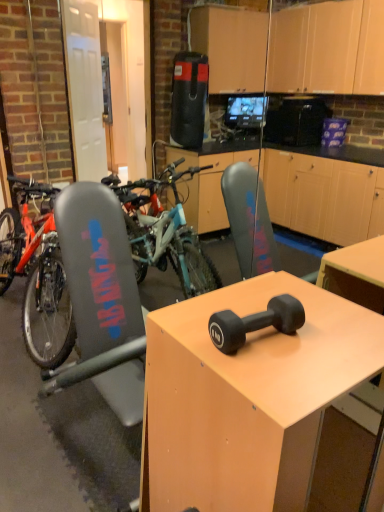
Question: Considering the relative sizes of matte black dumbbell at center and black rubber dumbbell at center in the image provided, is matte black dumbbell at center wider than black rubber dumbbell at center?

Choices:
 (A) no
 (B) yes

Answer: (B)

Question: Can you confirm if matte black dumbbell at center is positioned to the right of black rubber dumbbell at center?

Choices:
 (A) no
 (B) yes

Answer: (B)

Question: Is matte black dumbbell at center shorter than black rubber dumbbell at center?

Choices:
 (A) no
 (B) yes

Answer: (A)

Question: Does matte black dumbbell at center have a larger size compared to black rubber dumbbell at center?

Choices:
 (A) yes
 (B) no

Answer: (A)

Question: From a real-world perspective, is matte black dumbbell at center under black rubber dumbbell at center?

Choices:
 (A) yes
 (B) no

Answer: (A)

Question: Is matte black dumbbell at center turned away from black rubber dumbbell at center?

Choices:
 (A) no
 (B) yes

Answer: (A)

Question: Considering the relative positions of matte black dumbbell at center and teal matte mountain bike at left in the image provided, is matte black dumbbell at center to the left of teal matte mountain bike at left from the viewer's perspective?

Choices:
 (A) yes
 (B) no

Answer: (B)

Question: Considering the relative sizes of matte black dumbbell at center and teal matte mountain bike at left in the image provided, is matte black dumbbell at center bigger than teal matte mountain bike at left?

Choices:
 (A) no
 (B) yes

Answer: (A)

Question: Does matte black dumbbell at center have a smaller size compared to teal matte mountain bike at left?

Choices:
 (A) no
 (B) yes

Answer: (B)

Question: Can you confirm if matte black dumbbell at center is thinner than teal matte mountain bike at left?

Choices:
 (A) yes
 (B) no

Answer: (A)

Question: Considering the relative sizes of matte black dumbbell at center and teal matte mountain bike at left in the image provided, is matte black dumbbell at center shorter than teal matte mountain bike at left?

Choices:
 (A) no
 (B) yes

Answer: (B)

Question: From a real-world perspective, is matte black dumbbell at center on top of teal matte mountain bike at left?

Choices:
 (A) no
 (B) yes

Answer: (A)

Question: From a real-world perspective, is black rubber dumbbell at center positioned under matte black dumbbell at center based on gravity?

Choices:
 (A) yes
 (B) no

Answer: (B)